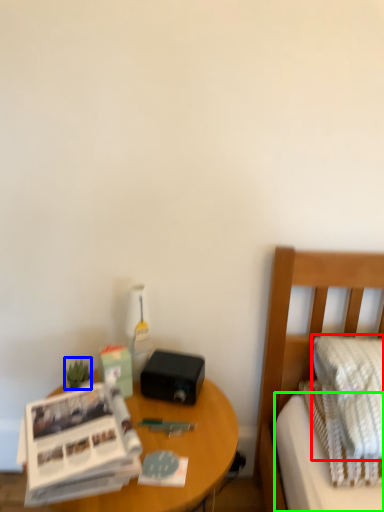
Question: Considering the real-world distances, which object is farthest from pillow (highlighted by a red box)? plant (highlighted by a blue box) or mattress (highlighted by a green box)?

Choices:
 (A) plant
 (B) mattress

Answer: (A)